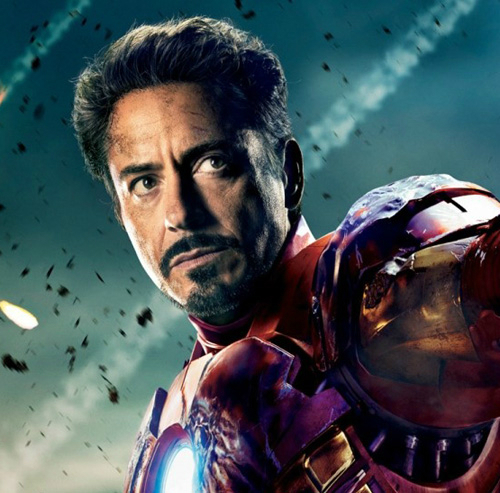
Where is `bright light`? bright light is located at coordinates (29, 321).